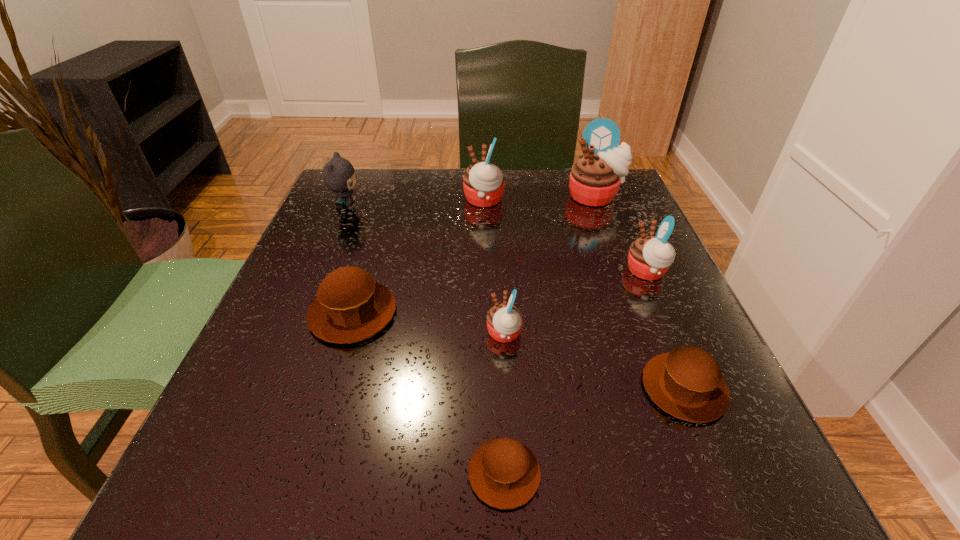
You are a GUI agent. You are given a task and a screenshot of the screen. Output one action in this format:
    pyautogui.click(x=<x>, y=<y>)
    Task: Click on the sixth tallest muffin
    The image size is (960, 540).
    Given the screenshot: What is the action you would take?
    coord(687,383)

Locate an element on the screen. This screenshot has width=960, height=540. the second nearest object is located at coordinates (687, 383).

You are a GUI agent. You are given a task and a screenshot of the screen. Output one action in this format:
    pyautogui.click(x=<x>, y=<y>)
    Task: Click on the shortest object
    
    Given the screenshot: What is the action you would take?
    pyautogui.click(x=504, y=473)

Locate an element on the screen. the nearest muffin is located at coordinates tap(504, 473).

The width and height of the screenshot is (960, 540). In order to click on vacant space located 0.160m on the front-facing side of the biggest pink muffin in this screenshot , I will do `click(616, 253)`.

Find the location of a particular element. Image resolution: width=960 pixels, height=540 pixels. free space located on the front-facing side of the sixth shortest muffin is located at coordinates (433, 200).

Identify the location of vacant space located 0.300m on the front-facing side of the sixth shortest muffin. This screenshot has width=960, height=540. (336, 200).

Locate an element on the screen. The image size is (960, 540). free space located 0.110m on the front-facing side of the sixth shortest muffin is located at coordinates (417, 200).

This screenshot has height=540, width=960. I want to click on vacant region located on the front-facing side of the kitten, so click(x=422, y=207).

This screenshot has width=960, height=540. I want to click on vacant space located 0.140m on the front-facing side of the third tallest muffin, so click(553, 272).